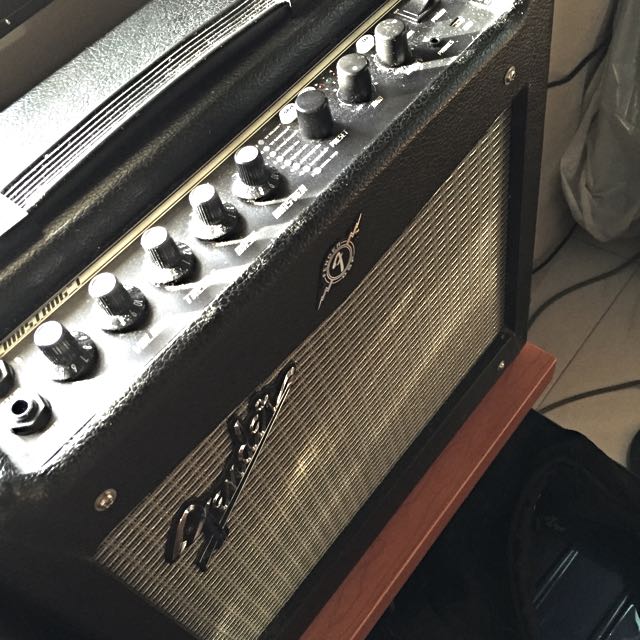
Locate an element on the screen. The image size is (640, 640). amplifier is located at coordinates pos(294,300).